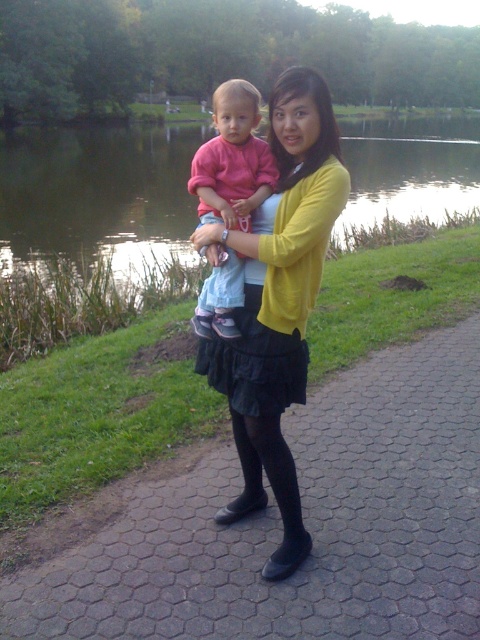
You are a photographer trying to capture a closeup of the black tights at center and the matte pink shirt at center. Which one should you focus on first if you want to ensure both are in focus?

The black tights at center is located below matte pink shirt at center, so you should focus on the matte pink shirt at center first since it is closer to the camera.